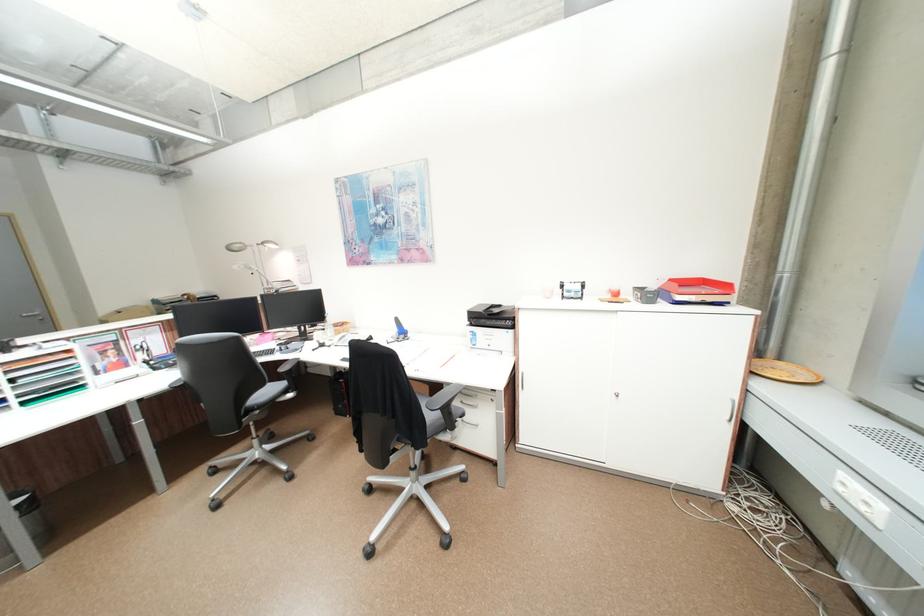
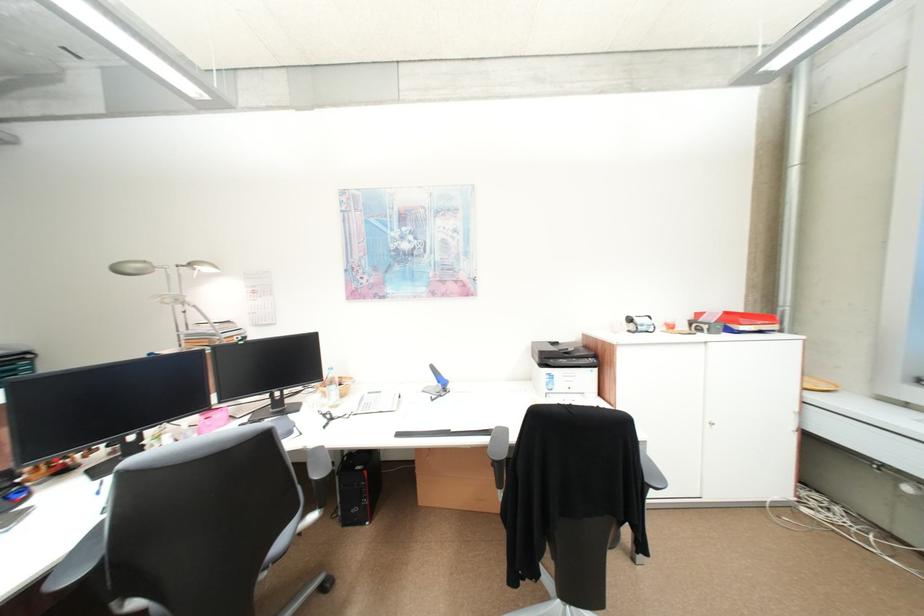
Based on the photo, in a continuous first-person perspective shot, in which direction is the camera moving?

The cameraman moved toward left, forward.